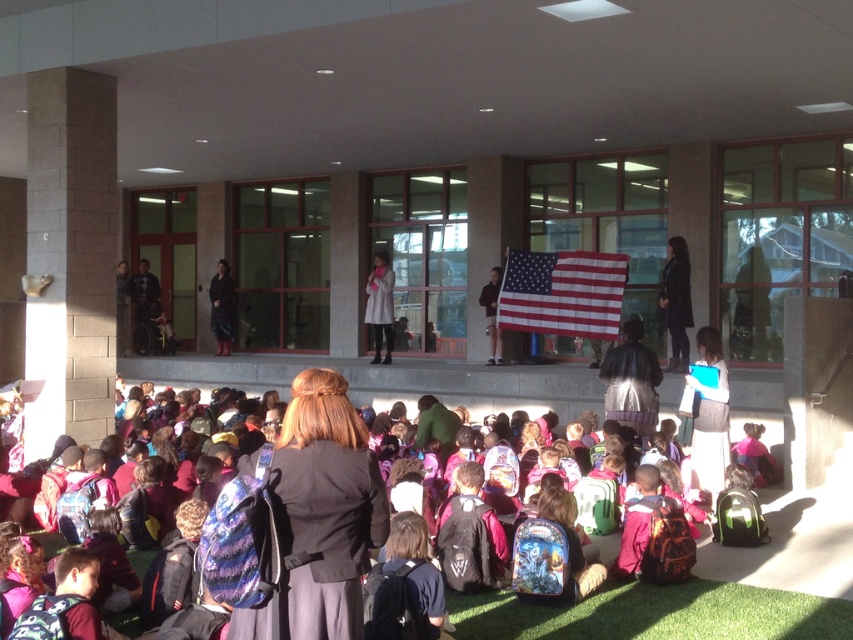
You are a student trying to find your backpack among the multicolored backpacks at lower center and the black leather jacket at center. Which object is located to the left of the other?

The multicolored backpacks at lower center are positioned to the left of the black leather jacket at center.

You are a student standing at the center of the assembly area and want to reach your backpack. You see the matte black backpack at center and the multicolored backpacks at lower center. Which backpack is closer to your current position?

The matte black backpack at center is closer to your current position since it is only 8.39 feet away from the multicolored backpacks at lower center, implying the matte black backpack is nearer to the center where you are standing.